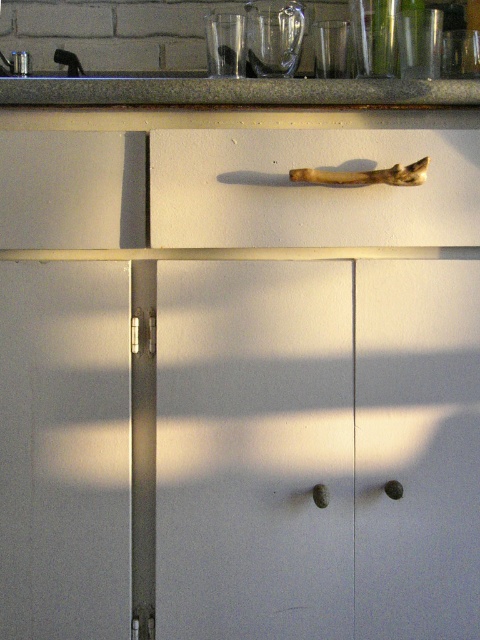
Question: Is wooden handle at center smaller than granite countertop at upper center?

Choices:
 (A) yes
 (B) no

Answer: (A)

Question: Does wooden handle at center have a larger size compared to granite countertop at upper center?

Choices:
 (A) yes
 (B) no

Answer: (B)

Question: Which of the following is the closest to the observer?

Choices:
 (A) pyautogui.click(x=286, y=240)
 (B) pyautogui.click(x=263, y=88)

Answer: (B)

Question: Which point is closer to the camera?

Choices:
 (A) (279, 177)
 (B) (100, 76)

Answer: (A)

Question: Is wooden handle at center positioned before granite countertop at upper center?

Choices:
 (A) yes
 (B) no

Answer: (B)